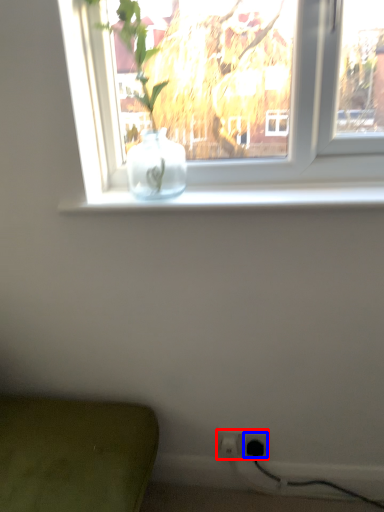
Question: Among these objects, which one is farthest to the camera, electric outlet (highlighted by a red box) or electric outlet (highlighted by a blue box)?

Choices:
 (A) electric outlet
 (B) electric outlet

Answer: (A)